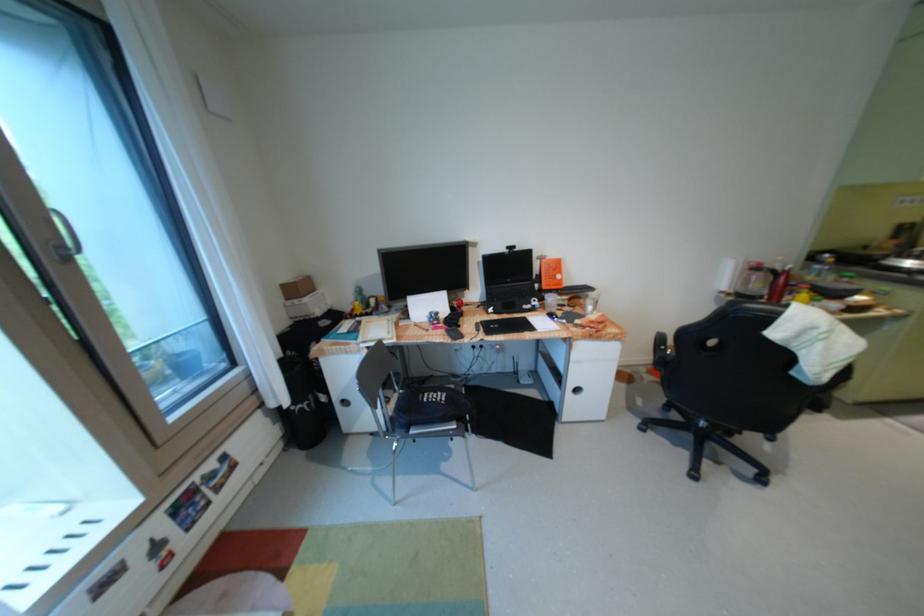
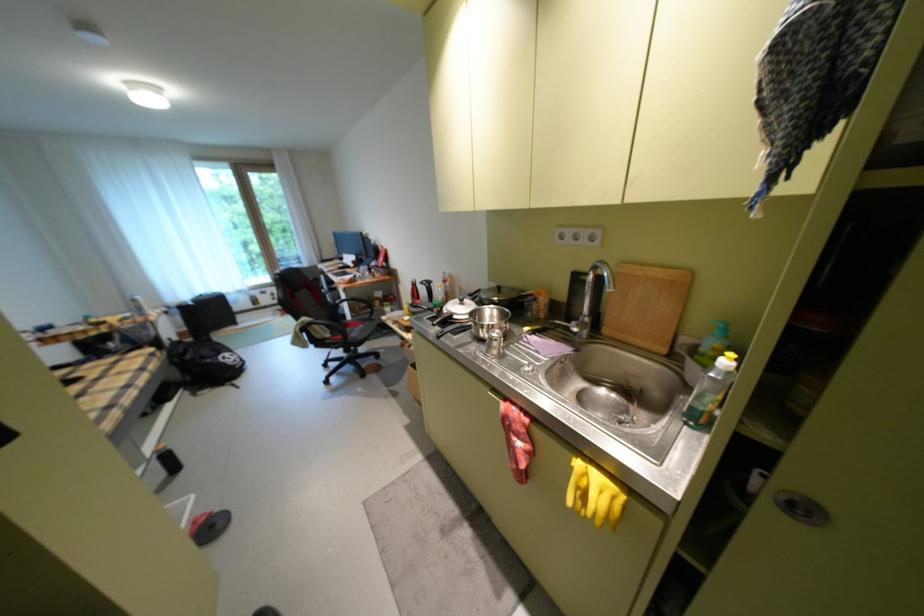
Where in the second image is the point corresponding to point 149,557 from the first image?

(280, 294)